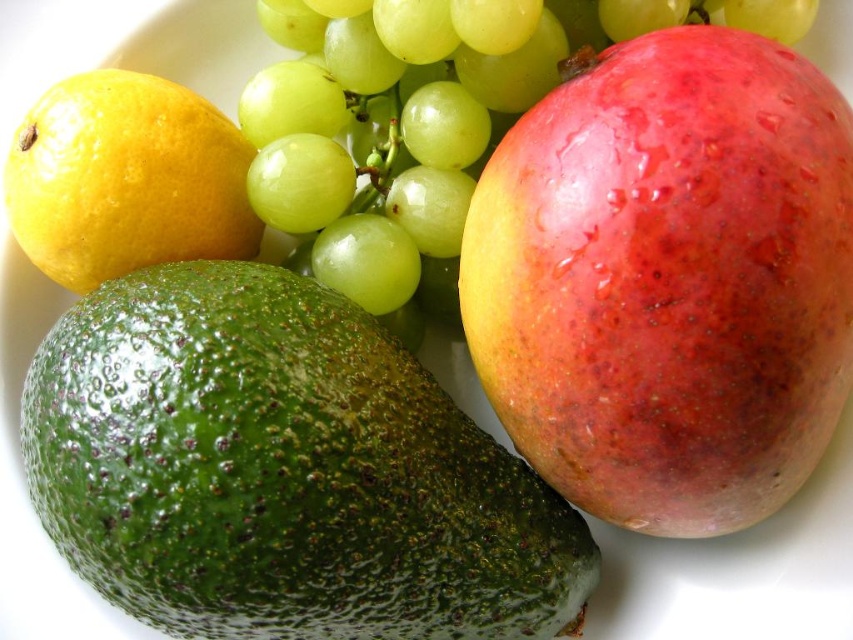
Is point (57, 515) positioned in front of point (437, 193)?

Yes, point (57, 515) is closer to viewer.

Who is shorter, green rough avocado at lower left or green matte grape at upper center?

Standing shorter between the two is green matte grape at upper center.

Locate an element on the screen. green rough avocado at lower left is located at coordinates (283, 472).

Is point (264, 8) in front of point (126, 92)?

No.

The height and width of the screenshot is (640, 853). What do you see at coordinates (425, 104) in the screenshot?
I see `green matte grape at upper center` at bounding box center [425, 104].

Does point (468, 60) lie behind point (136, 208)?

No, it is not.

This screenshot has width=853, height=640. I want to click on green matte grape at upper center, so click(x=425, y=104).

I want to click on shiny red mango at right, so click(x=668, y=280).

Does point (659, 244) come farther from viewer compared to point (643, 20)?

No, (659, 244) is in front of (643, 20).

Between point (717, 280) and point (595, 8), which one is positioned behind?

The point (595, 8) is more distant.

At what (x,y) coordinates should I click in order to perform the action: click on shiny red mango at right. Please return your answer as a coordinate pair (x, y). Looking at the image, I should click on (668, 280).